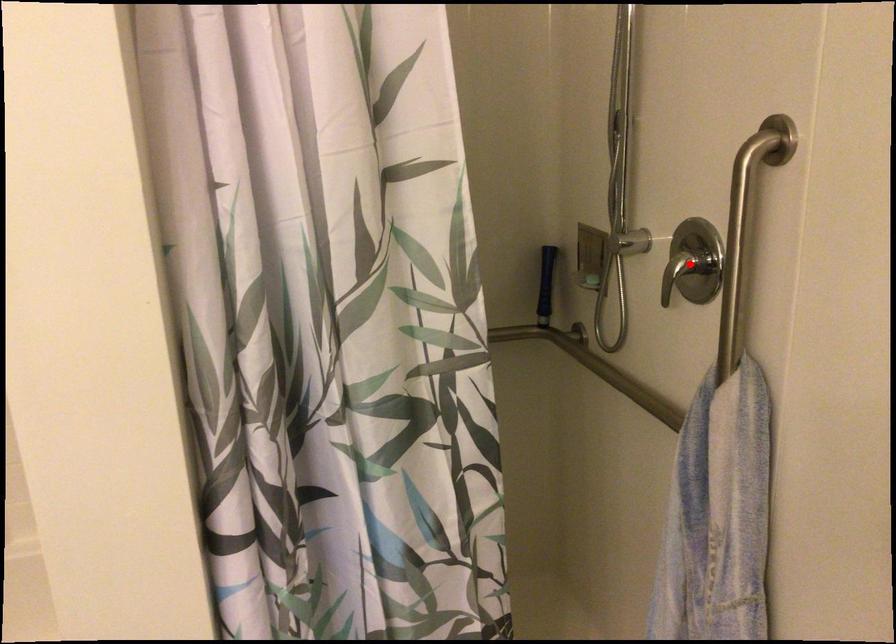
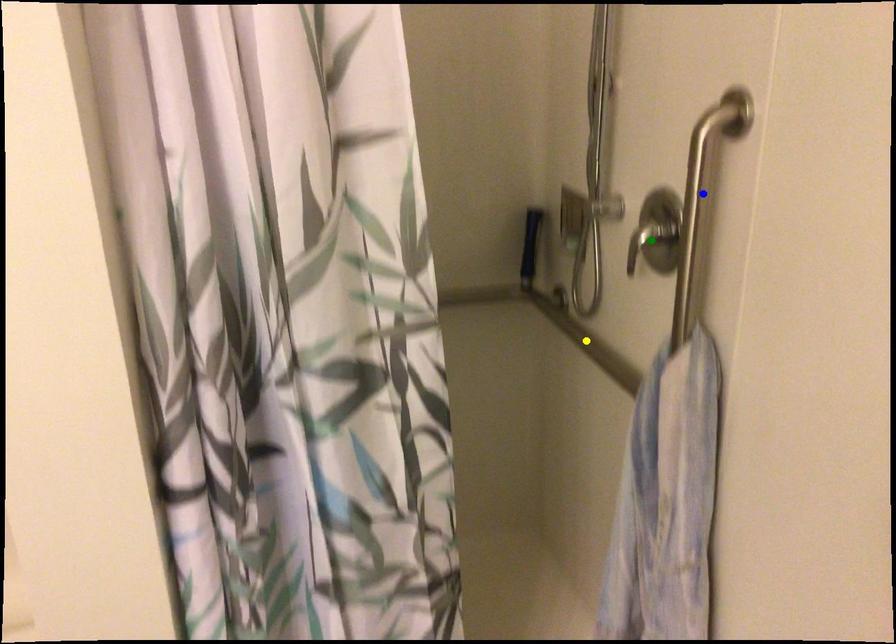
Question: I am providing you with two images of the same scene from different viewpoints. A red point is marked on the first image. You are given multiple points on the second image. Which point in image 2 is actually the same real-world point as the red point in image 1?

Choices:
 (A) yellow point
 (B) blue point
 (C) green point

Answer: (C)